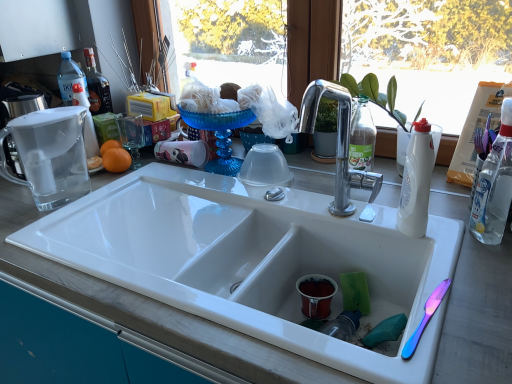
Identify the location of vacant space in front of white plastic bottle at right, the 3th bottle in the back-to-front sequence. (479, 275).